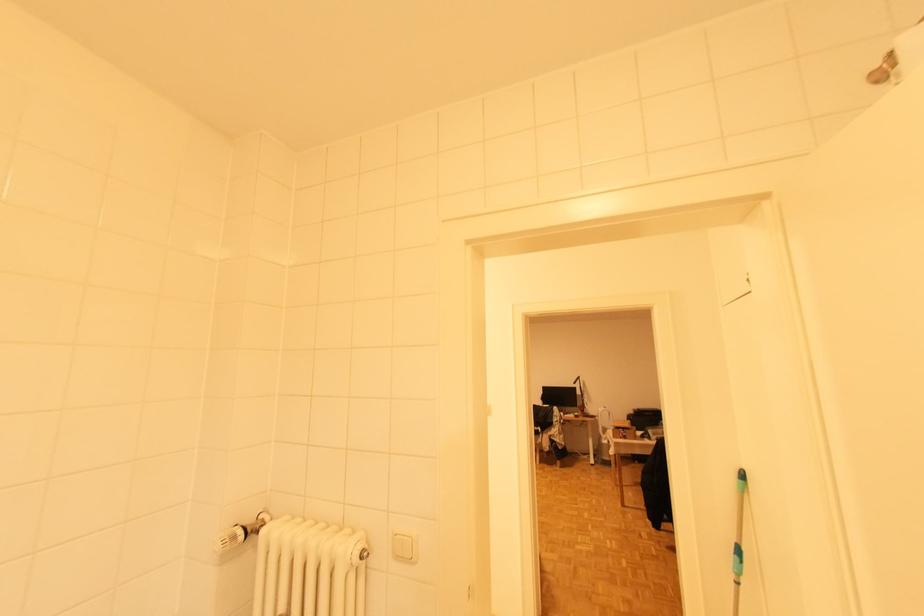
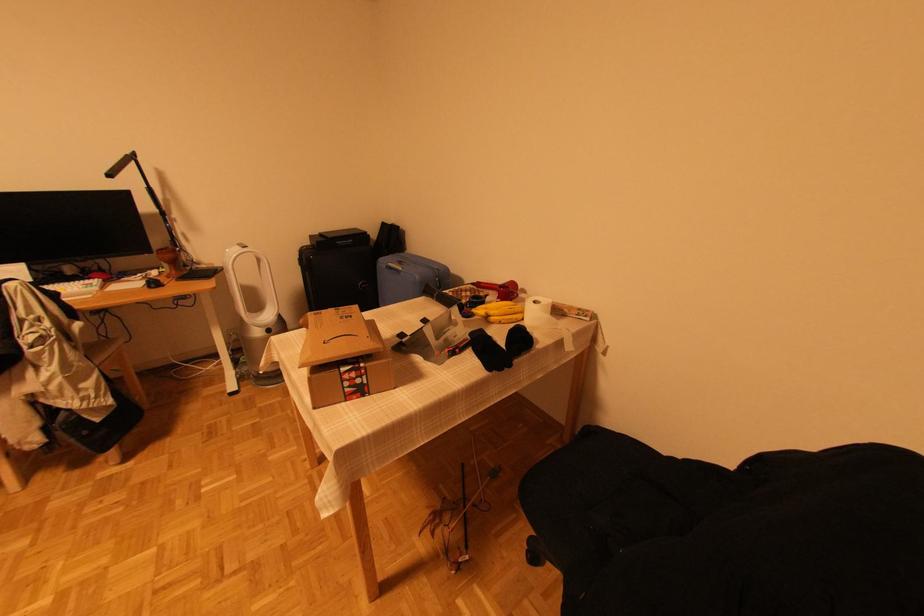
In the second image, find the point that corresponds to (585,395) in the first image.

(166, 215)